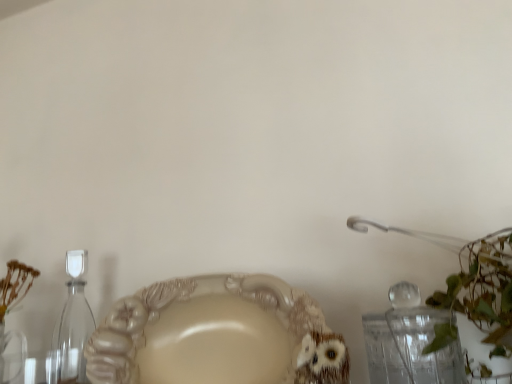
Question: Is transparent glass hourglass at left thinner than matte beige plate at center?

Choices:
 (A) no
 (B) yes

Answer: (B)

Question: Is transparent glass hourglass at left beside matte beige plate at center?

Choices:
 (A) yes
 (B) no

Answer: (B)

Question: Is transparent glass hourglass at left not near matte beige plate at center?

Choices:
 (A) yes
 (B) no

Answer: (B)

Question: Can you confirm if transparent glass hourglass at left is smaller than matte beige plate at center?

Choices:
 (A) no
 (B) yes

Answer: (B)

Question: Is transparent glass hourglass at left positioned beyond the bounds of matte beige plate at center?

Choices:
 (A) no
 (B) yes

Answer: (B)

Question: From the image's perspective, does transparent glass hourglass at left appear lower than matte beige plate at center?

Choices:
 (A) no
 (B) yes

Answer: (B)

Question: Is matte beige plate at center oriented towards transparent glass hourglass at left?

Choices:
 (A) no
 (B) yes

Answer: (A)

Question: Does matte beige plate at center come in front of transparent glass hourglass at left?

Choices:
 (A) no
 (B) yes

Answer: (B)

Question: Could transparent glass hourglass at left be considered to be inside matte beige plate at center?

Choices:
 (A) no
 (B) yes

Answer: (A)

Question: Is matte beige plate at center not within transparent glass hourglass at left?

Choices:
 (A) no
 (B) yes

Answer: (B)

Question: Can you confirm if matte beige plate at center is wider than transparent glass hourglass at left?

Choices:
 (A) yes
 (B) no

Answer: (A)

Question: Does matte beige plate at center come behind transparent glass hourglass at left?

Choices:
 (A) no
 (B) yes

Answer: (A)

Question: From a real-world perspective, is matte beige plate at center above or below transparent glass hourglass at left?

Choices:
 (A) below
 (B) above

Answer: (A)